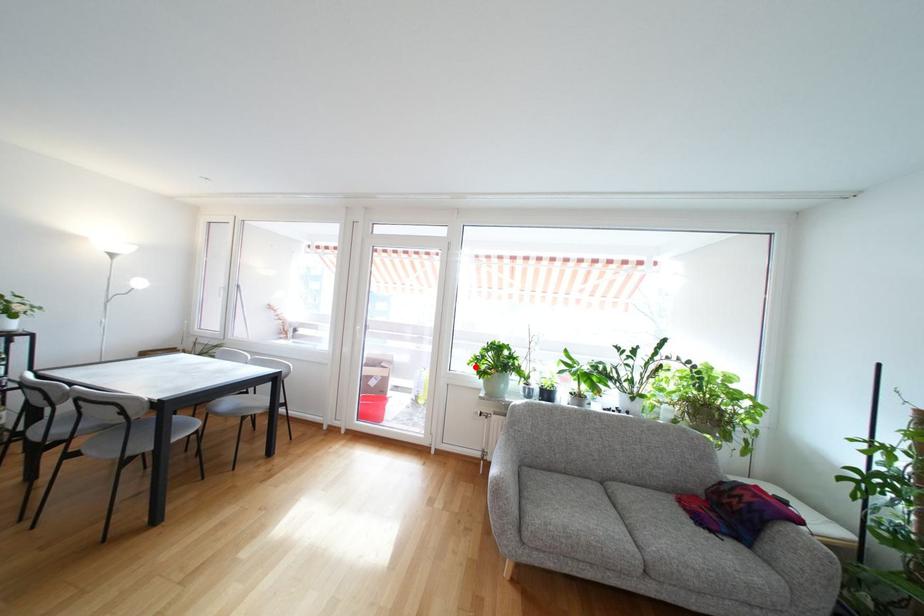
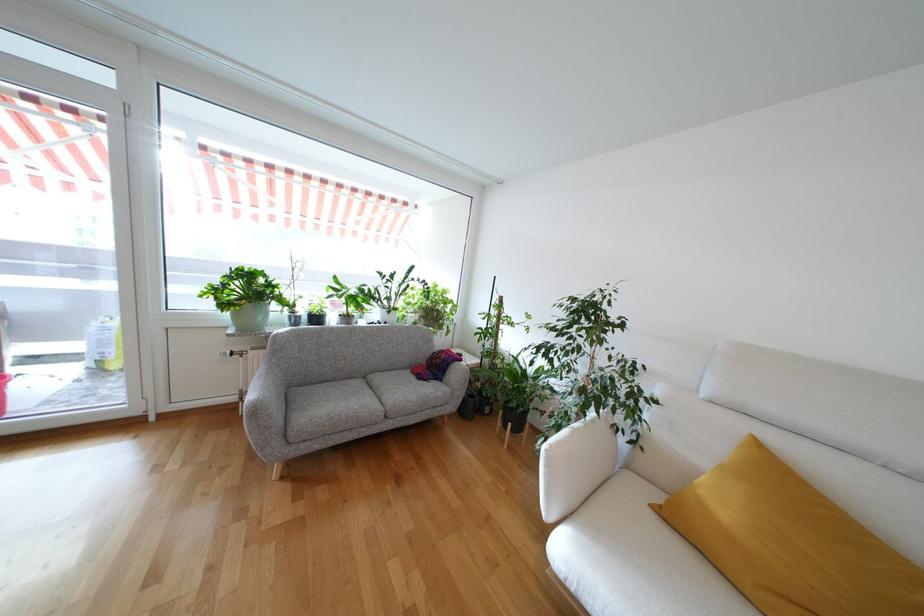
Find the pixel in the second image that matches the highlighted location in the first image.

(212, 300)